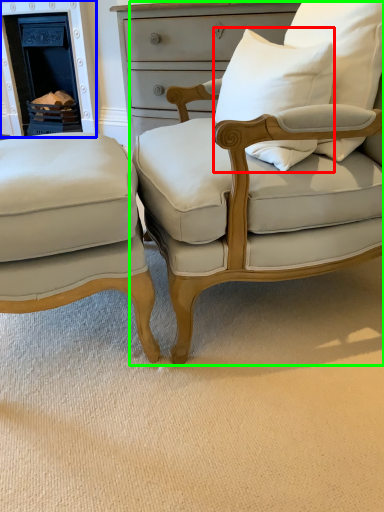
Question: Considering the real-world distances, which object is farthest from pillow (highlighted by a red box)? fireplace (highlighted by a blue box) or chair (highlighted by a green box)?

Choices:
 (A) fireplace
 (B) chair

Answer: (A)